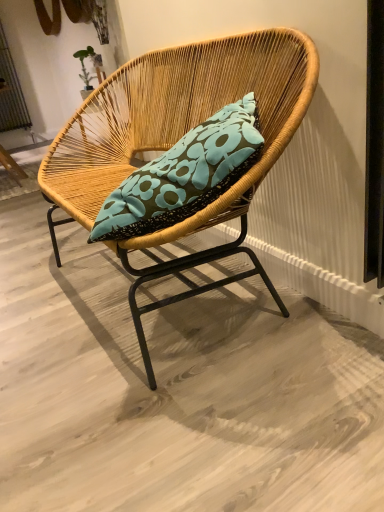
Question: Is natural woven chair at center to the left of metallic silver screen door at upper left from the viewer's perspective?

Choices:
 (A) yes
 (B) no

Answer: (B)

Question: Can you confirm if natural woven chair at center is wider than metallic silver screen door at upper left?

Choices:
 (A) no
 (B) yes

Answer: (B)

Question: From a real-world perspective, is natural woven chair at center located higher than metallic silver screen door at upper left?

Choices:
 (A) no
 (B) yes

Answer: (A)

Question: Considering the relative positions of natural woven chair at center and metallic silver screen door at upper left in the image provided, is natural woven chair at center in front of metallic silver screen door at upper left?

Choices:
 (A) no
 (B) yes

Answer: (B)

Question: From a real-world perspective, is natural woven chair at center physically below metallic silver screen door at upper left?

Choices:
 (A) yes
 (B) no

Answer: (A)

Question: Is the depth of natural woven chair at center greater than that of metallic silver screen door at upper left?

Choices:
 (A) no
 (B) yes

Answer: (A)

Question: From the image's perspective, would you say metallic silver screen door at upper left is positioned over natural woven chair at center?

Choices:
 (A) no
 (B) yes

Answer: (B)

Question: Is metallic silver screen door at upper left far away from natural woven chair at center?

Choices:
 (A) yes
 (B) no

Answer: (A)

Question: From a real-world perspective, is metallic silver screen door at upper left on natural woven chair at center?

Choices:
 (A) no
 (B) yes

Answer: (B)

Question: Does metallic silver screen door at upper left turn towards natural woven chair at center?

Choices:
 (A) no
 (B) yes

Answer: (B)

Question: From the image's perspective, would you say metallic silver screen door at upper left is shown under natural woven chair at center?

Choices:
 (A) no
 (B) yes

Answer: (A)

Question: Considering the relative sizes of metallic silver screen door at upper left and natural woven chair at center in the image provided, is metallic silver screen door at upper left thinner than natural woven chair at center?

Choices:
 (A) no
 (B) yes

Answer: (B)

Question: Considering the positions of point (11, 103) and point (137, 307), is point (11, 103) closer or farther from the camera than point (137, 307)?

Choices:
 (A) closer
 (B) farther

Answer: (B)